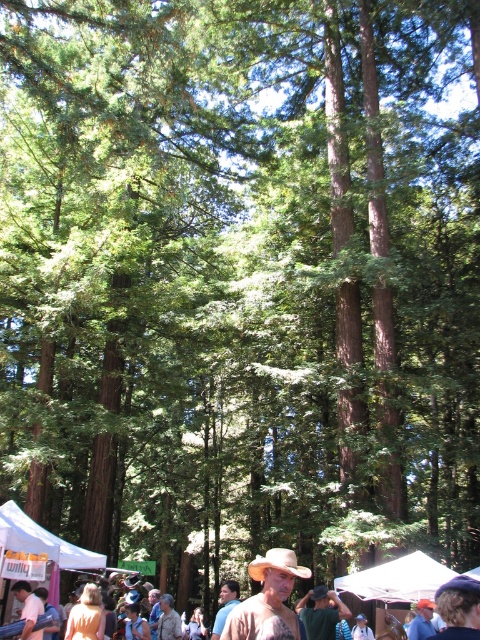
You are standing in the forest scene and see a point at coordinates (267, 600). Which object is this point located on?

The point at coordinates (267, 600) is located on the brown matte hat at center.

You are a photographer trying to capture a clear shot of both the brown matte hat at center and the brown leather hat at center. Since you can only focus on one object at a time, which hat should you focus on to ensure the other remains in the background?

You should focus on the brown matte hat at center because it is in front of the brown leather hat at center, so if you focus on the front hat, the other will naturally be in the background.

You are standing in the forest and see the brown leather hat at center. If you walk 0.05 units to the right along the x axis, will you be closer to the hat?

The brown leather hat at center is located at point (322, 612). Moving 0.05 units to the right along the x axis would increase your x coordinate, so you would be further away from the hat. Therefore, you will not be closer to the hat.